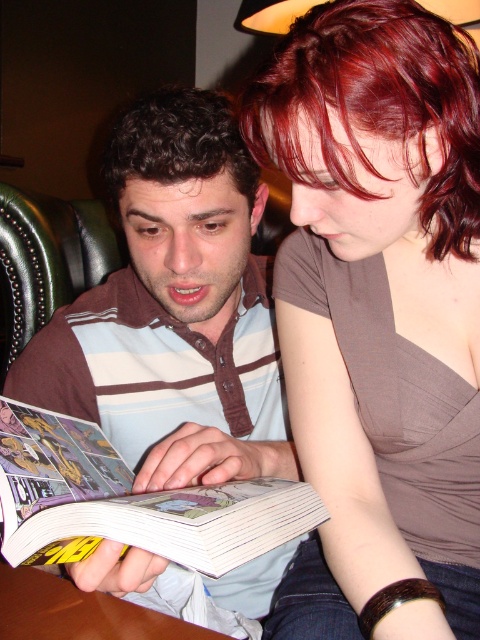
Is brown satin blouse at upper right positioned in front of brown striped shirt at center?

Yes, it is in front of brown striped shirt at center.

Between brown satin blouse at upper right and brown striped shirt at center, which one appears on the right side from the viewer's perspective?

brown satin blouse at upper right

Find the location of a particular element. brown satin blouse at upper right is located at coordinates [x=379, y=314].

Between point (206, 196) and point (314, 502), which one is positioned in front?

Point (314, 502)

Does brown striped shirt at center have a smaller size compared to comic book paper at center?

Incorrect, brown striped shirt at center is not smaller in size than comic book paper at center.

Who is more forward, (264, 195) or (110, 512)?

Point (110, 512)

The width and height of the screenshot is (480, 640). Identify the location of brown striped shirt at center. click(x=173, y=308).

Is dark brown hair at upper center wider than brown curly hair at center?

Correct, the width of dark brown hair at upper center exceeds that of brown curly hair at center.

Does point (343, 49) come closer to viewer compared to point (253, 161)?

Yes, it is in front of point (253, 161).

Where is `dark brown hair at upper center`? The height and width of the screenshot is (640, 480). dark brown hair at upper center is located at coordinates (375, 106).